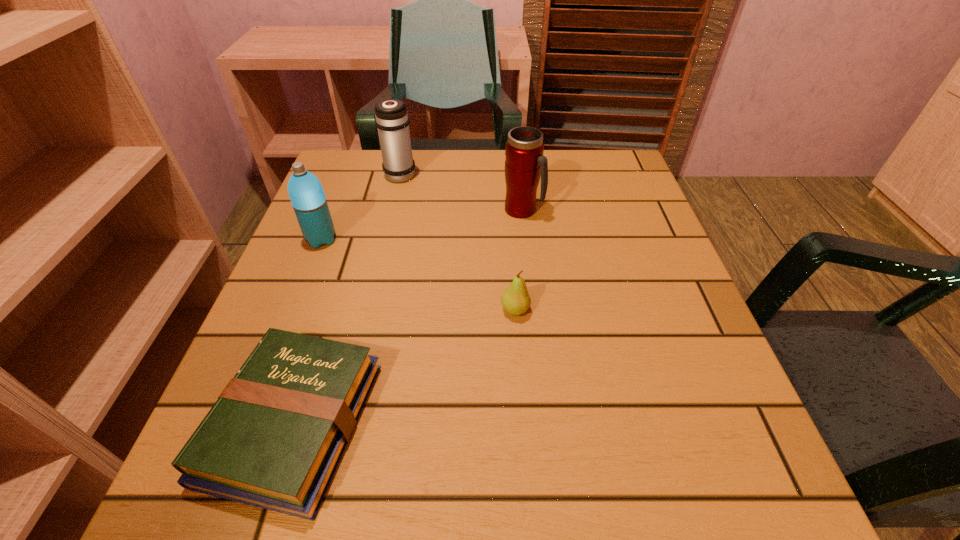
I want to click on vacant region located on the side with the handle of the second nearest thermos bottle, so click(577, 210).

The height and width of the screenshot is (540, 960). I want to click on vacant space located 0.050m on the back of the leftmost thermos bottle, so click(330, 215).

Locate an element on the screen. The image size is (960, 540). vacant space located on the right of the fourth farthest object is located at coordinates pyautogui.click(x=591, y=310).

Where is `free spot located 0.280m on the right of the nearest object`? free spot located 0.280m on the right of the nearest object is located at coordinates (564, 422).

Locate an element on the screen. object located at the near edge is located at coordinates (274, 438).

At what (x,y) coordinates should I click in order to perform the action: click on book present at the left edge. Please return your answer as a coordinate pair (x, y). The height and width of the screenshot is (540, 960). Looking at the image, I should click on (274, 438).

The height and width of the screenshot is (540, 960). Find the location of `object situated at the far left corner`. object situated at the far left corner is located at coordinates (392, 121).

You are a GUI agent. You are given a task and a screenshot of the screen. Output one action in this format:
    pyautogui.click(x=<x>, y=<y>)
    Task: Click on the object located at the near left corner
    The image size is (960, 540).
    Given the screenshot: What is the action you would take?
    274,438

This screenshot has height=540, width=960. Identify the location of vacant area at the far edge of the desktop. (411, 186).

You are a GUI agent. You are given a task and a screenshot of the screen. Output one action in this format:
    pyautogui.click(x=<x>, y=<y>)
    Task: Click on the vacant area at the near edge
    
    Given the screenshot: What is the action you would take?
    pyautogui.click(x=455, y=485)